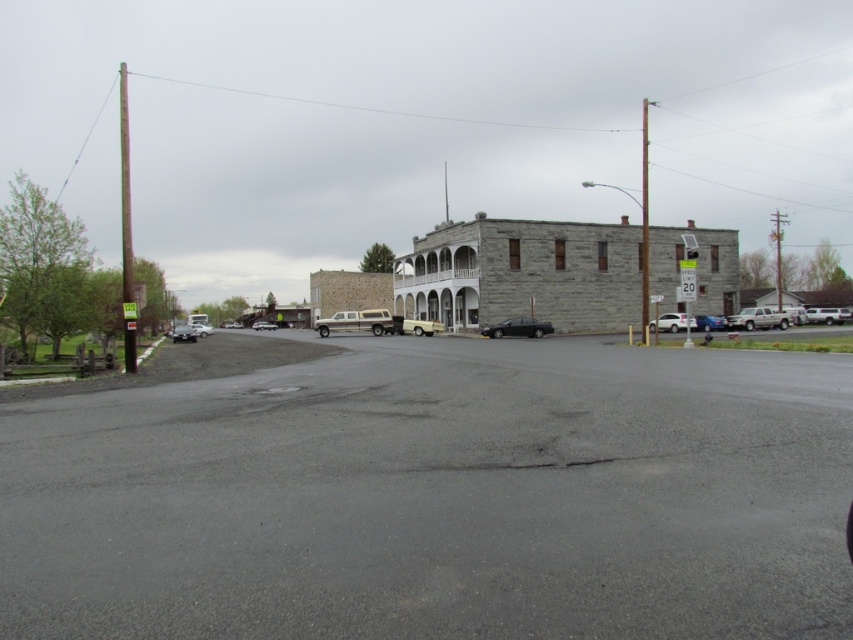
Question: Which of the following is the farthest from the observer?

Choices:
 (A) (175, 324)
 (B) (849, 316)

Answer: (A)

Question: From the image, what is the correct spatial relationship of white matte sedan at center in relation to white matte truck at center?

Choices:
 (A) left
 (B) right

Answer: (A)

Question: Which point appears closest to the camera in this image?

Choices:
 (A) (706, 317)
 (B) (181, 337)

Answer: (A)

Question: Can you confirm if asphalt at center is smaller than white matte truck at right?

Choices:
 (A) no
 (B) yes

Answer: (A)

Question: Is gold metallic van at center to the right of shiny black sedan at center from the viewer's perspective?

Choices:
 (A) yes
 (B) no

Answer: (B)

Question: Which point appears farthest from the camera in this image?

Choices:
 (A) coord(350,316)
 (B) coord(698,326)
 (C) coord(497,260)
 (D) coord(274,324)

Answer: (D)